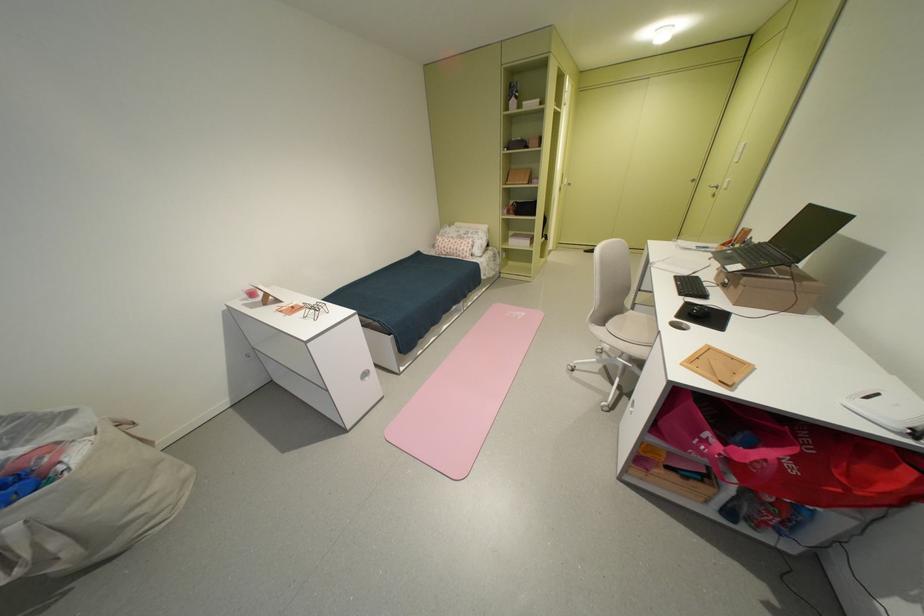
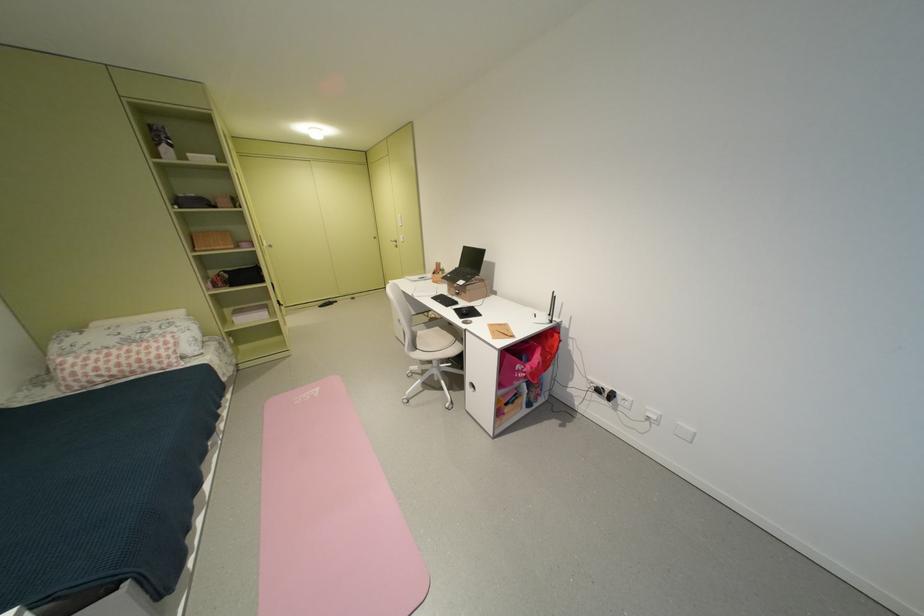
Find the pixel in the second image that matches the point at 713,448 in the first image.

(530, 376)